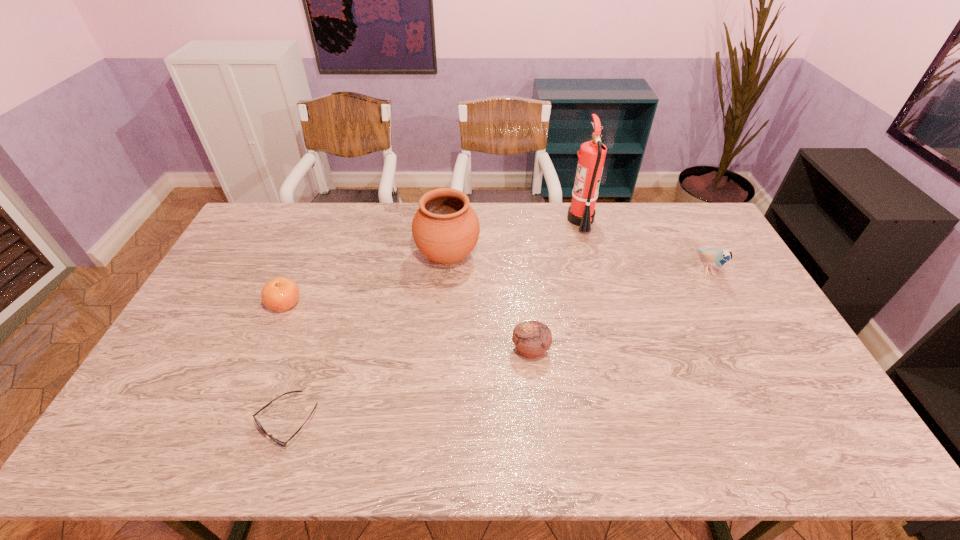
Find the location of a particular element. This screenshot has width=960, height=540. the tallest object is located at coordinates (592, 154).

Where is `the farthest object`? the farthest object is located at coordinates (592, 154).

Where is `the fifth shortest object`? The width and height of the screenshot is (960, 540). the fifth shortest object is located at coordinates (445, 228).

Where is `pottery`? pottery is located at coordinates (445, 228).

The height and width of the screenshot is (540, 960). In order to click on bird in this screenshot , I will do `click(717, 258)`.

Image resolution: width=960 pixels, height=540 pixels. What are the coordinates of `the rightmost object` in the screenshot? It's located at (717, 258).

Where is `the third object from right to left`? the third object from right to left is located at coordinates (532, 338).

You are a GUI agent. You are given a task and a screenshot of the screen. Output one action in this format:
    pyautogui.click(x=<x>, y=<y>)
    Task: Click on the second nearest object
    
    Given the screenshot: What is the action you would take?
    pyautogui.click(x=532, y=338)

You are a GUI agent. You are given a task and a screenshot of the screen. Output one action in this format:
    pyautogui.click(x=<x>, y=<y>)
    Task: Click on the leftmost object
    The image size is (960, 540).
    Given the screenshot: What is the action you would take?
    click(x=279, y=294)

Find the location of a particular element. The height and width of the screenshot is (540, 960). the third nearest object is located at coordinates (279, 294).